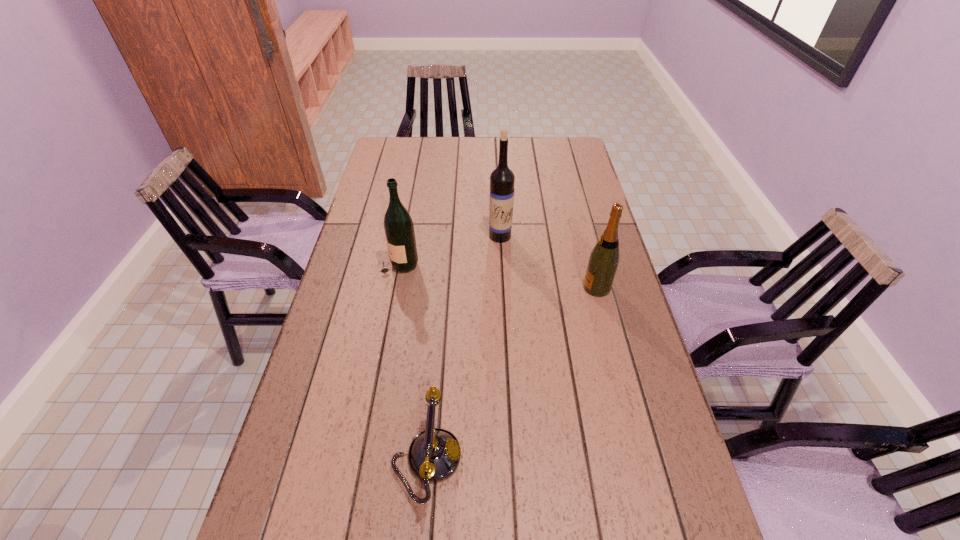
You are a GUI agent. You are given a task and a screenshot of the screen. Output one action in this format:
    pyautogui.click(x=<x>, y=<y>)
    Task: Click on the object that is the closest to the second nearest object
    The height and width of the screenshot is (540, 960).
    Given the screenshot: What is the action you would take?
    pyautogui.click(x=502, y=179)

Find the location of a particular element. The image size is (960, 540). wine bottle that stands as the second closest to the rightmost object is located at coordinates (399, 229).

Find the location of a particular element. wine bottle that stands as the closest to the third nearest object is located at coordinates pos(502,179).

The image size is (960, 540). Identify the location of free spot that satisfies the following two spatial constraints: 1. on the label of the farthest wine bottle; 2. on the dial of the second object from left to right. (512, 459).